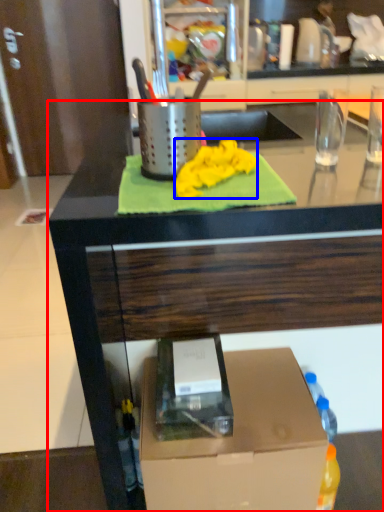
Question: Which point is further to the camera, countertop (highlighted by a red box) or cloth (highlighted by a blue box)?

Choices:
 (A) countertop
 (B) cloth

Answer: (B)